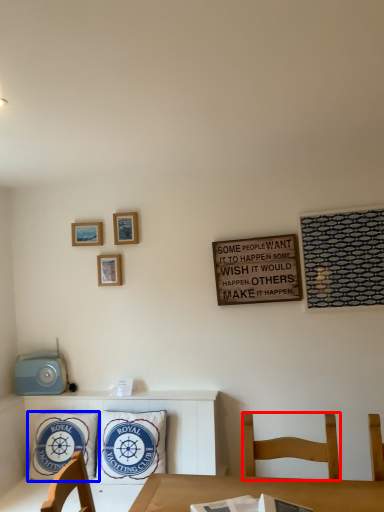
Question: Which point is further to the camera, chair (highlighted by a red box) or pillow (highlighted by a blue box)?

Choices:
 (A) chair
 (B) pillow

Answer: (B)